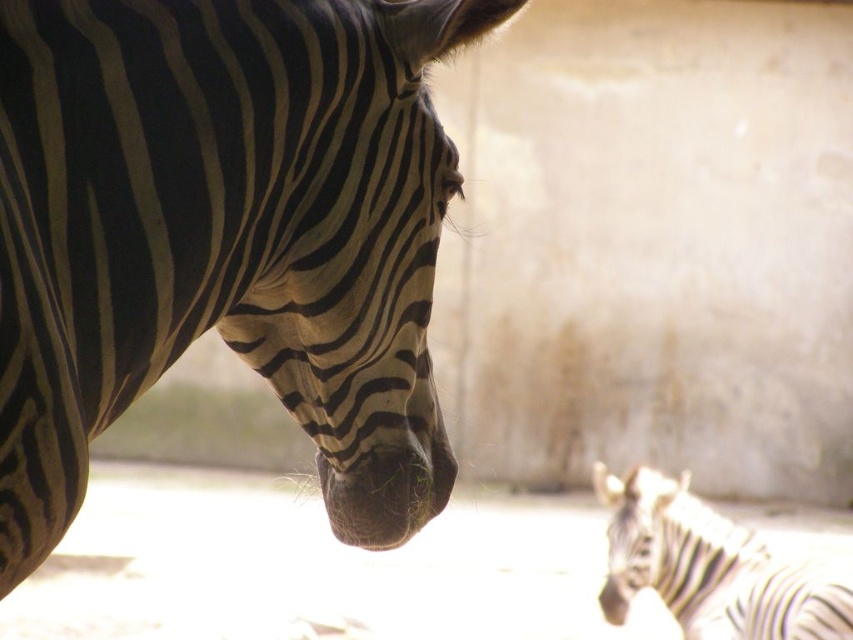
Does black and white striped zebra at left appear over black and white striped zebra nose at lower right?

Yes.

The height and width of the screenshot is (640, 853). I want to click on black and white striped zebra at left, so click(224, 236).

Based on the photo, who is positioned more to the right, black and white striped zebra at lower right or black and white striped zebra nose at lower right?

black and white striped zebra at lower right is more to the right.

Is black and white striped zebra at lower right in front of black and white striped zebra nose at lower right?

Yes, black and white striped zebra at lower right is in front of black and white striped zebra nose at lower right.

Who is more forward, (671, 548) or (605, 586)?

Point (671, 548)

I want to click on black and white striped zebra at lower right, so click(714, 564).

Is black and white striped zebra at left closer to the viewer compared to black and white striped zebra at lower right?

Yes, it is in front of black and white striped zebra at lower right.

The width and height of the screenshot is (853, 640). In order to click on black and white striped zebra at left in this screenshot , I will do `click(224, 236)`.

Locate an element on the screen. The image size is (853, 640). black and white striped zebra at left is located at coordinates 224,236.